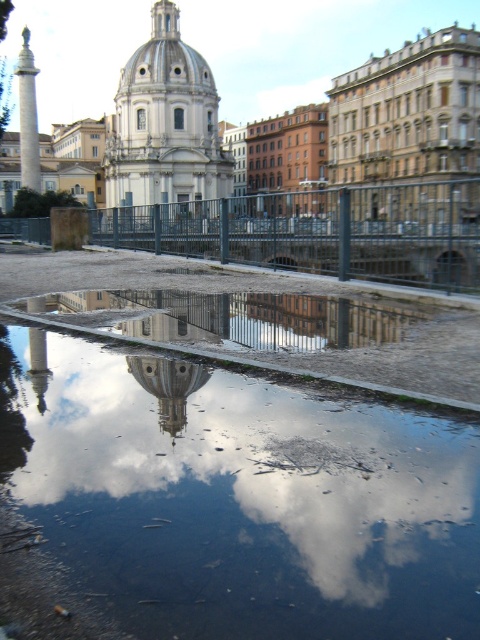
Can you confirm if white glossy dome at center is taller than polished marble column at left?

No.

Is white glossy dome at center thinner than polished marble column at left?

Correct, white glossy dome at center's width is less than polished marble column at left's.

Which is in front, point (162, 412) or point (23, 163)?

Point (162, 412)

This screenshot has width=480, height=640. I want to click on white glossy dome at center, so tap(168, 385).

Does transparent water at center have a lesser width compared to polished marble column at left?

Indeed, transparent water at center has a lesser width compared to polished marble column at left.

Between point (60, 557) and point (22, 60), which one is positioned in front?

Point (60, 557)

Image resolution: width=480 pixels, height=640 pixels. I want to click on transparent water at center, so click(x=240, y=499).

Who is more distant from viewer, (405, 484) or (171, 392)?

The point (171, 392) is more distant.

Can you confirm if transparent water at center is taller than white glossy dome at center?

Correct, transparent water at center is much taller as white glossy dome at center.

Is point (351, 580) less distant than point (170, 364)?

Yes, it is in front of point (170, 364).

Locate an element on the screen. transparent water at center is located at coordinates (240, 499).